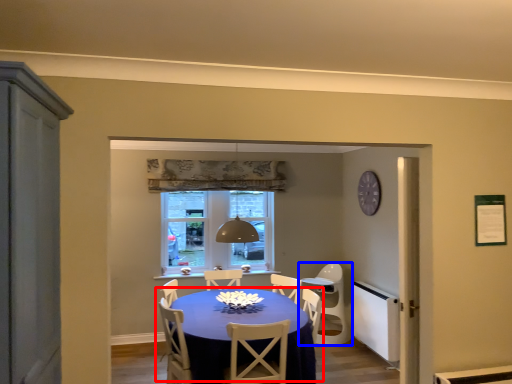
Question: Which object appears closest to the camera in this image, kitchen & dining room table (highlighted by a red box) or chair (highlighted by a blue box)?

Choices:
 (A) kitchen & dining room table
 (B) chair

Answer: (A)